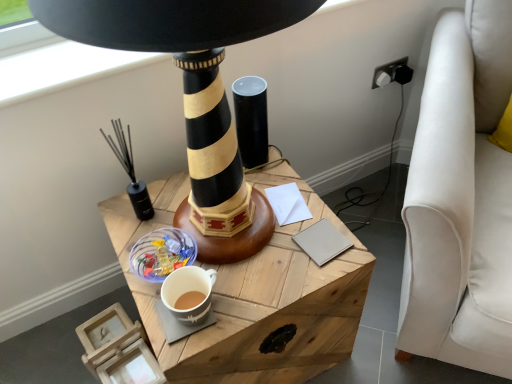
The image size is (512, 384). Identify the location of free spot behind beige leather notepad at center, placed as the 1th notepad when sorted from front to back. (296, 194).